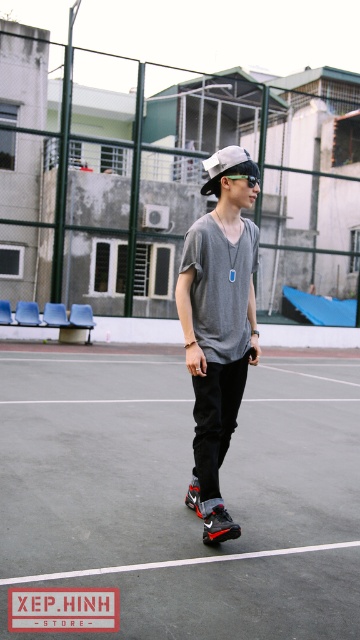
Which of these two, matte gray t-shirt at center or white matte baseball cap at center, stands shorter?

Standing shorter between the two is white matte baseball cap at center.

Does matte gray t-shirt at center appear on the left side of white matte baseball cap at center?

Indeed, matte gray t-shirt at center is positioned on the left side of white matte baseball cap at center.

Is point (201, 424) behind point (235, 164)?

Yes, point (201, 424) is behind point (235, 164).

You are a GUI agent. You are given a task and a screenshot of the screen. Output one action in this format:
    pyautogui.click(x=<x>, y=<y>)
    Task: Click on the matte gray t-shirt at center
    The height and width of the screenshot is (640, 360).
    Given the screenshot: What is the action you would take?
    pyautogui.click(x=218, y=324)

Consider the image. How distant is black rubber tennis court at center from white matte baseball cap at center?

The distance of black rubber tennis court at center from white matte baseball cap at center is 18.08 feet.

Does point (70, 476) come closer to viewer compared to point (219, 186)?

No, (70, 476) is further to viewer.

Identify the location of black rubber tennis court at center. This screenshot has height=640, width=360. (182, 496).

Which is more to the left, black rubber tennis court at center or matte gray t-shirt at center?

black rubber tennis court at center is more to the left.

Which of these two, black rubber tennis court at center or matte gray t-shirt at center, stands taller?

matte gray t-shirt at center is taller.

Describe the element at coordinates (182, 496) in the screenshot. I see `black rubber tennis court at center` at that location.

At what (x,y) coordinates should I click in order to perform the action: click on black rubber tennis court at center. Please return your answer as a coordinate pair (x, y). Looking at the image, I should click on (182, 496).